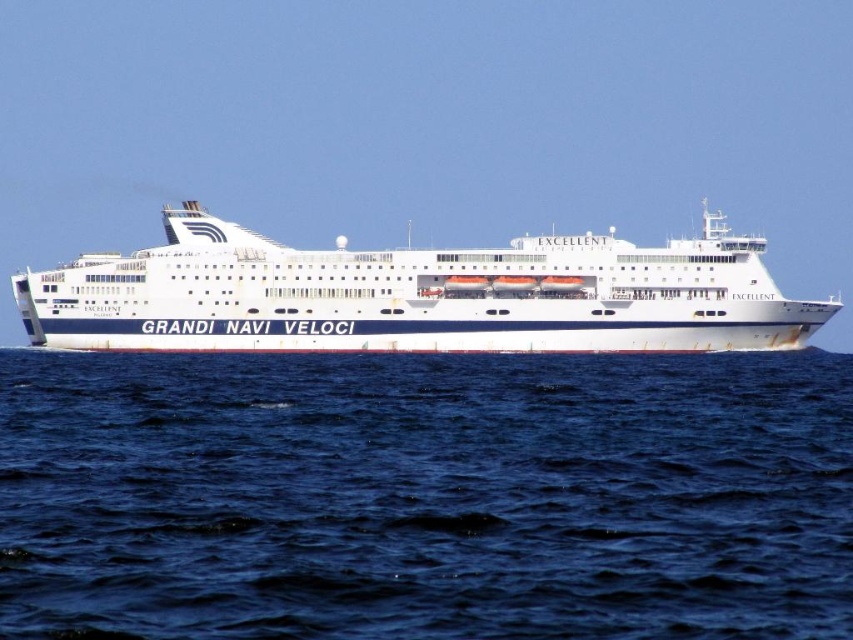
Can you confirm if blue water at center is positioned to the right of white glossy cruise ship at center?

Yes, blue water at center is to the right of white glossy cruise ship at center.

Between blue water at center and white glossy cruise ship at center, which one has less height?

Standing shorter between the two is blue water at center.

Describe the element at coordinates (425, 497) in the screenshot. This screenshot has width=853, height=640. I see `blue water at center` at that location.

Where is `blue water at center`? The image size is (853, 640). blue water at center is located at coordinates (425, 497).